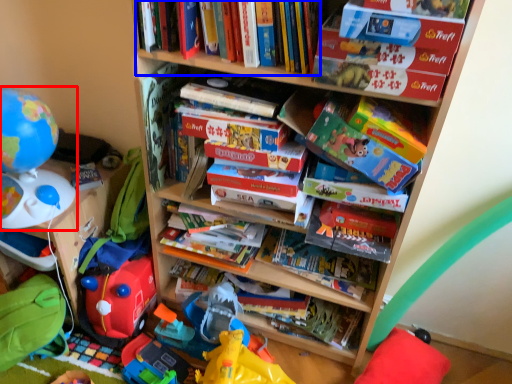
Question: Which object is further to the camera taking this photo, toy (highlighted by a red box) or book (highlighted by a blue box)?

Choices:
 (A) toy
 (B) book

Answer: (A)